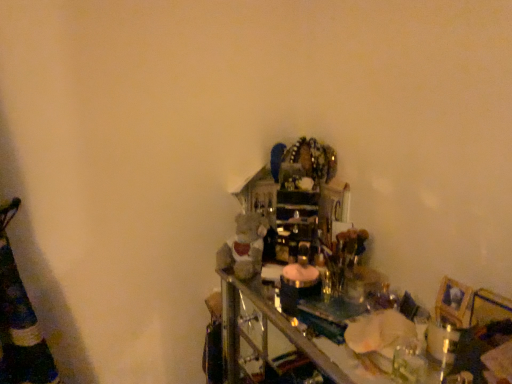
What do you see at coordinates (453, 303) in the screenshot? The image size is (512, 384). I see `wooden picture frame at lower right` at bounding box center [453, 303].

Where is `wooden picture frame at lower right`? Image resolution: width=512 pixels, height=384 pixels. wooden picture frame at lower right is located at coordinates (453, 303).

Where is `fuzzy fabric teddy bear at center`? fuzzy fabric teddy bear at center is located at coordinates (244, 248).

In order to face fuzzy fabric teddy bear at center, should I rotate leftwards or rightwards?

Turn left approximately 2.032 degrees to face it.

The width and height of the screenshot is (512, 384). What do you see at coordinates (244, 248) in the screenshot?
I see `fuzzy fabric teddy bear at center` at bounding box center [244, 248].

Find the location of a particular element. The height and width of the screenshot is (384, 512). wooden picture frame at lower right is located at coordinates (453, 303).

Between wooden picture frame at lower right and fuzzy fabric teddy bear at center, which one appears on the right side from the viewer's perspective?

From the viewer's perspective, wooden picture frame at lower right appears more on the right side.

Relative to fuzzy fabric teddy bear at center, is wooden picture frame at lower right in front or behind?

Clearly, wooden picture frame at lower right is in front of fuzzy fabric teddy bear at center.

Which is farther from the camera, (439, 318) or (238, 243)?

Point (238, 243)

From the image's perspective, is wooden picture frame at lower right under fuzzy fabric teddy bear at center?

Yes, from the image's perspective, wooden picture frame at lower right is beneath fuzzy fabric teddy bear at center.

From a real-world perspective, between wooden picture frame at lower right and fuzzy fabric teddy bear at center, who is vertically higher?

wooden picture frame at lower right, from a real-world perspective.

Looking at their sizes, would you say wooden picture frame at lower right is wider or thinner than fuzzy fabric teddy bear at center?

Clearly, wooden picture frame at lower right has less width compared to fuzzy fabric teddy bear at center.

Can you confirm if wooden picture frame at lower right is taller than fuzzy fabric teddy bear at center?

No, wooden picture frame at lower right is not taller than fuzzy fabric teddy bear at center.

Which of these two, wooden picture frame at lower right or fuzzy fabric teddy bear at center, is bigger?

Bigger between the two is fuzzy fabric teddy bear at center.

Would you say wooden picture frame at lower right is outside fuzzy fabric teddy bear at center?

wooden picture frame at lower right is positioned outside fuzzy fabric teddy bear at center.

Is there a large distance between wooden picture frame at lower right and fuzzy fabric teddy bear at center?

That's not correct — wooden picture frame at lower right is a little close to fuzzy fabric teddy bear at center.

Does wooden picture frame at lower right turn towards fuzzy fabric teddy bear at center?

No, wooden picture frame at lower right is not facing towards fuzzy fabric teddy bear at center.

Looking at this image, how different are the orientations of wooden picture frame at lower right and fuzzy fabric teddy bear at center in degrees?

23.4 degrees separate the facing orientations of wooden picture frame at lower right and fuzzy fabric teddy bear at center.

Locate an element on the screen. Image resolution: width=512 pixels, height=384 pixels. picture frame in front of the fuzzy fabric teddy bear at center is located at coordinates (453, 303).

Between fuzzy fabric teddy bear at center and wooden picture frame at lower right, which one appears on the left side from the viewer's perspective?

Positioned to the left is fuzzy fabric teddy bear at center.

Is fuzzy fabric teddy bear at center in front of or behind wooden picture frame at lower right in the image?

fuzzy fabric teddy bear at center is positioned farther from the viewer than wooden picture frame at lower right.

Which is in front, point (234, 231) or point (470, 305)?

The point (470, 305) is closer.

From the image's perspective, is fuzzy fabric teddy bear at center located above or below wooden picture frame at lower right?

From the image's perspective, fuzzy fabric teddy bear at center appears above wooden picture frame at lower right.

From a real-world perspective, who is located higher, fuzzy fabric teddy bear at center or wooden picture frame at lower right?

In real-world perspective, wooden picture frame at lower right is above.

Which object is wider, fuzzy fabric teddy bear at center or wooden picture frame at lower right?

fuzzy fabric teddy bear at center is wider.

From the picture: Does fuzzy fabric teddy bear at center have a lesser height compared to wooden picture frame at lower right?

In fact, fuzzy fabric teddy bear at center may be taller than wooden picture frame at lower right.

Looking at the image, does fuzzy fabric teddy bear at center seem bigger or smaller compared to wooden picture frame at lower right?

fuzzy fabric teddy bear at center is bigger than wooden picture frame at lower right.

Based on the photo, choose the correct answer: Is fuzzy fabric teddy bear at center inside wooden picture frame at lower right or outside it?

fuzzy fabric teddy bear at center is outside wooden picture frame at lower right.

Is there a large distance between fuzzy fabric teddy bear at center and wooden picture frame at lower right?

That's not correct — fuzzy fabric teddy bear at center is a little close to wooden picture frame at lower right.

Is fuzzy fabric teddy bear at center looking in the opposite direction of wooden picture frame at lower right?

No, fuzzy fabric teddy bear at center is not facing the opposite direction of wooden picture frame at lower right.

How much distance is there between fuzzy fabric teddy bear at center and wooden picture frame at lower right?

25.15 inches.

Locate an element on the screen. toy above the wooden picture frame at lower right (from the image's perspective) is located at coordinates (244, 248).

Locate an element on the screen. This screenshot has height=384, width=512. picture frame that appears below the fuzzy fabric teddy bear at center (from the image's perspective) is located at coordinates (453, 303).

There is a fuzzy fabric teddy bear at center. Where is `picture frame above it (from a real-world perspective)`? This screenshot has width=512, height=384. picture frame above it (from a real-world perspective) is located at coordinates (453, 303).